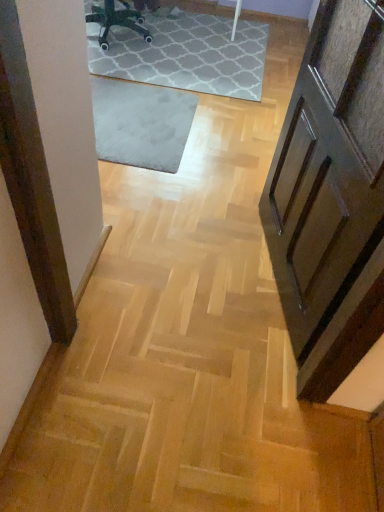
Image resolution: width=384 pixels, height=512 pixels. Find the location of `vacant space to the left of wooden panelled door at right`. vacant space to the left of wooden panelled door at right is located at coordinates (207, 256).